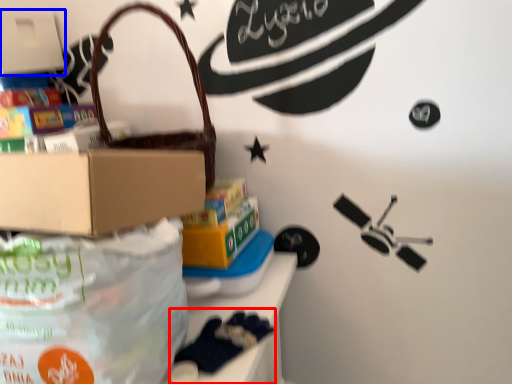
Question: Which point is further to the camera, toy (highlighted by a red box) or box (highlighted by a blue box)?

Choices:
 (A) toy
 (B) box

Answer: (B)